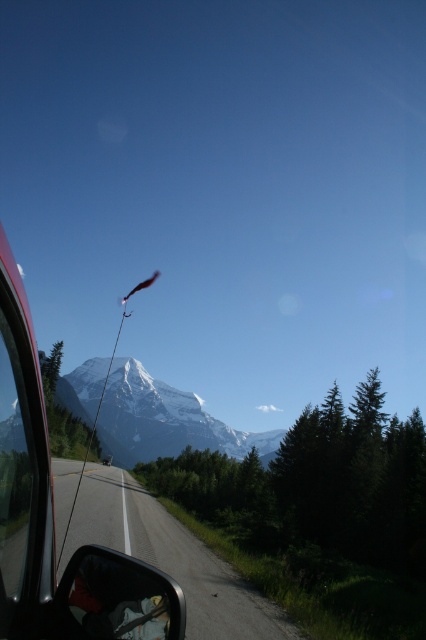
Question: Does white snow-covered mountain at center come behind matte black side mirror at lower left?

Choices:
 (A) no
 (B) yes

Answer: (B)

Question: Which point is closer to the camera taking this photo?

Choices:
 (A) 81,528
 (B) 98,630

Answer: (B)

Question: Which point appears farthest from the camera in this image?

Choices:
 (A) (296, 637)
 (B) (62, 628)

Answer: (A)

Question: From the image, what is the correct spatial relationship of metallic red car at left in relation to asphalt road at center?

Choices:
 (A) left
 (B) right

Answer: (B)

Question: Is asphalt road at center to the left of white snow-covered mountain at center from the viewer's perspective?

Choices:
 (A) no
 (B) yes

Answer: (A)

Question: Which object is closer to the camera taking this photo?

Choices:
 (A) white snow-covered mountain at center
 (B) metallic red car at left
 (C) matte black side mirror at lower left
 (D) asphalt road at center

Answer: (B)